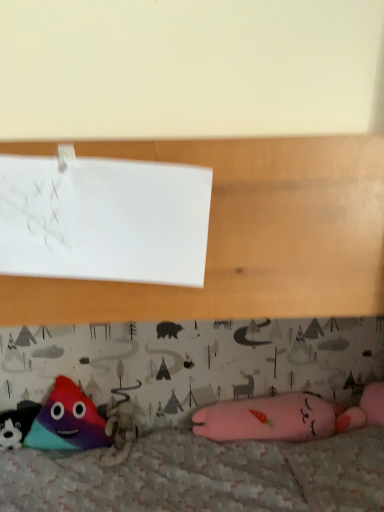
What are the coordinates of `multicolored plush toy at lower left, the third toy positioned from the right` in the screenshot? It's located at (17, 424).

The image size is (384, 512). Describe the element at coordinates (68, 421) in the screenshot. I see `multicolored plush triangle at lower left, arranged as the second toy when viewed from the right` at that location.

Where is `multicolored plush toy at lower left, positioned as the 1th toy in left-to-right order`? multicolored plush toy at lower left, positioned as the 1th toy in left-to-right order is located at coordinates (17, 424).

Considering the relative sizes of white paper at upper left and multicolored plush toy at lower left, positioned as the 1th toy in left-to-right order, in the image provided, is white paper at upper left bigger than multicolored plush toy at lower left, positioned as the 1th toy in left-to-right order,?

No.

Is white paper at upper left positioned with its back to multicolored plush toy at lower left, the third toy positioned from the right?

No, white paper at upper left's orientation is not away from multicolored plush toy at lower left, the third toy positioned from the right.

Considering the positions of objects white paper at upper left and multicolored plush toy at lower left, the third toy positioned from the right, in the image provided, who is behind, white paper at upper left or multicolored plush toy at lower left, the third toy positioned from the right,?

multicolored plush toy at lower left, the third toy positioned from the right, is behind.

This screenshot has height=512, width=384. In order to click on paper that appears in front of the multicolored plush toy at lower left, the third toy positioned from the right in this screenshot , I will do click(104, 219).

Which is behind, point (286, 439) or point (181, 273)?

The point (286, 439) is farther.

Can you confirm if pink plush toy at lower right, positioned as the 1th toy in right-to-left order, is smaller than white paper at upper left?

No.

How distant is pink plush toy at lower right, positioned as the 1th toy in right-to-left order, from white paper at upper left?

pink plush toy at lower right, positioned as the 1th toy in right-to-left order, and white paper at upper left are 4.29 feet apart from each other.

Looking at their sizes, would you say pink plush toy at lower right, the third toy when ordered from left to right, is wider or thinner than white paper at upper left?

Clearly, pink plush toy at lower right, the third toy when ordered from left to right, has more width compared to white paper at upper left.

Is pink plush toy at lower right, positioned as the 1th toy in right-to-left order, further to the viewer compared to multicolored plush toy at lower left, positioned as the 1th toy in left-to-right order?

No, pink plush toy at lower right, positioned as the 1th toy in right-to-left order, is closer to the camera.

Would you say pink plush toy at lower right, the third toy when ordered from left to right, is outside multicolored plush toy at lower left, positioned as the 1th toy in left-to-right order?

pink plush toy at lower right, the third toy when ordered from left to right, lies outside multicolored plush toy at lower left, positioned as the 1th toy in left-to-right order,'s area.

Would you consider multicolored plush triangle at lower left, arranged as the second toy when viewed from the right, to be distant from white paper at upper left?

Indeed, multicolored plush triangle at lower left, arranged as the second toy when viewed from the right, is not near white paper at upper left.

Which of these two, multicolored plush triangle at lower left, which ranks as the second toy in left-to-right order, or white paper at upper left, stands shorter?

Standing shorter between the two is white paper at upper left.

Considering the sizes of objects multicolored plush triangle at lower left, which ranks as the second toy in left-to-right order, and white paper at upper left in the image provided, who is thinner, multicolored plush triangle at lower left, which ranks as the second toy in left-to-right order, or white paper at upper left?

white paper at upper left is thinner.

From a real-world perspective, is multicolored plush triangle at lower left, which ranks as the second toy in left-to-right order, positioned under white paper at upper left based on gravity?

Correct, in the physical world, multicolored plush triangle at lower left, which ranks as the second toy in left-to-right order, is lower than white paper at upper left.

Looking at this image, considering the relative positions of white paper at upper left and multicolored plush triangle at lower left, which ranks as the second toy in left-to-right order, in the image provided, is white paper at upper left to the right of multicolored plush triangle at lower left, which ranks as the second toy in left-to-right order, from the viewer's perspective?

Yes, white paper at upper left is to the right of multicolored plush triangle at lower left, which ranks as the second toy in left-to-right order.

Is white paper at upper left bigger than multicolored plush triangle at lower left, which ranks as the second toy in left-to-right order?

Actually, white paper at upper left might be smaller than multicolored plush triangle at lower left, which ranks as the second toy in left-to-right order.

Is white paper at upper left looking in the opposite direction of multicolored plush triangle at lower left, arranged as the second toy when viewed from the right?

No, white paper at upper left is not facing the opposite direction of multicolored plush triangle at lower left, arranged as the second toy when viewed from the right.

From the image's perspective, does white paper at upper left appear lower than multicolored plush triangle at lower left, which ranks as the second toy in left-to-right order?

Incorrect, from the image's perspective, white paper at upper left is higher than multicolored plush triangle at lower left, which ranks as the second toy in left-to-right order.

In the image, is multicolored plush triangle at lower left, which ranks as the second toy in left-to-right order, on the left side or the right side of multicolored plush toy at lower left, the third toy positioned from the right?

Clearly, multicolored plush triangle at lower left, which ranks as the second toy in left-to-right order, is on the right of multicolored plush toy at lower left, the third toy positioned from the right, in the image.

Based on the photo, can you confirm if multicolored plush triangle at lower left, arranged as the second toy when viewed from the right, is thinner than multicolored plush toy at lower left, positioned as the 1th toy in left-to-right order?

Indeed, multicolored plush triangle at lower left, arranged as the second toy when viewed from the right, has a lesser width compared to multicolored plush toy at lower left, positioned as the 1th toy in left-to-right order.

Could you measure the distance between multicolored plush triangle at lower left, which ranks as the second toy in left-to-right order, and multicolored plush toy at lower left, the third toy positioned from the right?

4.74 inches.

Are multicolored plush triangle at lower left, arranged as the second toy when viewed from the right, and multicolored plush toy at lower left, the third toy positioned from the right, located far from each other?

No.

Consider the image. Considering the relative sizes of multicolored plush toy at lower left, positioned as the 1th toy in left-to-right order, and white paper at upper left in the image provided, is multicolored plush toy at lower left, positioned as the 1th toy in left-to-right order, bigger than white paper at upper left?

Indeed, multicolored plush toy at lower left, positioned as the 1th toy in left-to-right order, has a larger size compared to white paper at upper left.

Is multicolored plush toy at lower left, the third toy positioned from the right, positioned with its back to white paper at upper left?

No, multicolored plush toy at lower left, the third toy positioned from the right,'s orientation is not away from white paper at upper left.

Considering the relative sizes of multicolored plush toy at lower left, the third toy positioned from the right, and white paper at upper left in the image provided, is multicolored plush toy at lower left, the third toy positioned from the right, shorter than white paper at upper left?

Indeed, multicolored plush toy at lower left, the third toy positioned from the right, has a lesser height compared to white paper at upper left.

Can you tell me how much multicolored plush toy at lower left, the third toy positioned from the right, and white paper at upper left differ in facing direction?

There is a 3.83-degree angle between the facing directions of multicolored plush toy at lower left, the third toy positioned from the right, and white paper at upper left.

From the white paper at upper left, count 3rd toys backward and point to it. Please provide its 2D coordinates.

[(17, 424)]

Where is `toy that is the 2nd one when counting downward from the white paper at upper left (from the image's perspective)`? toy that is the 2nd one when counting downward from the white paper at upper left (from the image's perspective) is located at coordinates (287, 417).

Considering their positions, is multicolored plush toy at lower left, the third toy positioned from the right, positioned further to multicolored plush triangle at lower left, arranged as the second toy when viewed from the right, than white paper at upper left?

Among the two, white paper at upper left is located further to multicolored plush triangle at lower left, arranged as the second toy when viewed from the right.

Which object lies nearer to the anchor point white paper at upper left, multicolored plush toy at lower left, positioned as the 1th toy in left-to-right order, or multicolored plush triangle at lower left, which ranks as the second toy in left-to-right order?

Based on the image, multicolored plush triangle at lower left, which ranks as the second toy in left-to-right order, appears to be nearer to white paper at upper left.

When comparing their distances from pink plush toy at lower right, the third toy when ordered from left to right, does multicolored plush triangle at lower left, arranged as the second toy when viewed from the right, or white paper at upper left seem further?

white paper at upper left is positioned further to the anchor pink plush toy at lower right, the third toy when ordered from left to right.

Estimate the real-world distances between objects in this image. Which object is closer to multicolored plush toy at lower left, positioned as the 1th toy in left-to-right order, pink plush toy at lower right, positioned as the 1th toy in right-to-left order, or multicolored plush triangle at lower left, arranged as the second toy when viewed from the right?

multicolored plush triangle at lower left, arranged as the second toy when viewed from the right, is positioned closer to the anchor multicolored plush toy at lower left, positioned as the 1th toy in left-to-right order.

Based on their spatial positions, is multicolored plush triangle at lower left, which ranks as the second toy in left-to-right order, or multicolored plush toy at lower left, the third toy positioned from the right, closer to white paper at upper left?

The object closer to white paper at upper left is multicolored plush triangle at lower left, which ranks as the second toy in left-to-right order.

Based on the photo, looking at the image, which one is located further to multicolored plush triangle at lower left, arranged as the second toy when viewed from the right, pink plush toy at lower right, the third toy when ordered from left to right, or white paper at upper left?

white paper at upper left is further to multicolored plush triangle at lower left, arranged as the second toy when viewed from the right.

Which object lies further to the anchor point multicolored plush toy at lower left, the third toy positioned from the right, white paper at upper left or multicolored plush triangle at lower left, which ranks as the second toy in left-to-right order?

The object further to multicolored plush toy at lower left, the third toy positioned from the right, is white paper at upper left.

Looking at the image, which one is located closer to white paper at upper left, pink plush toy at lower right, the third toy when ordered from left to right, or multicolored plush triangle at lower left, arranged as the second toy when viewed from the right?

multicolored plush triangle at lower left, arranged as the second toy when viewed from the right, is closer to white paper at upper left.

Find the location of a particular element. This screenshot has height=512, width=384. toy between white paper at upper left and multicolored plush triangle at lower left, which ranks as the second toy in left-to-right order, from front to back is located at coordinates (287, 417).

Find the location of a particular element. The height and width of the screenshot is (512, 384). toy between multicolored plush toy at lower left, the third toy positioned from the right, and pink plush toy at lower right, positioned as the 1th toy in right-to-left order is located at coordinates tap(68, 421).